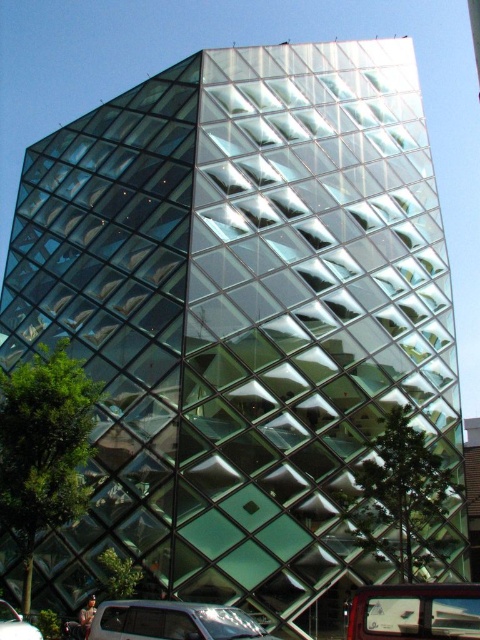
Question: Estimate the real-world distances between objects in this image. Which object is closer to the matte silver van at lower center?

Choices:
 (A) metallic silver car at lower right
 (B) metallic silver car at lower left

Answer: (A)

Question: Which of these objects is positioned closest to the metallic silver car at lower left?

Choices:
 (A) metallic silver car at lower right
 (B) matte silver van at lower center

Answer: (B)

Question: Does metallic silver car at lower right have a lesser width compared to metallic silver car at lower left?

Choices:
 (A) yes
 (B) no

Answer: (B)

Question: Based on their relative distances, which object is nearer to the metallic silver car at lower left?

Choices:
 (A) matte silver van at lower center
 (B) metallic silver car at lower right

Answer: (A)

Question: Is matte silver van at lower center to the left of metallic silver car at lower left from the viewer's perspective?

Choices:
 (A) no
 (B) yes

Answer: (A)

Question: Is metallic silver car at lower right bigger than metallic silver car at lower left?

Choices:
 (A) no
 (B) yes

Answer: (B)